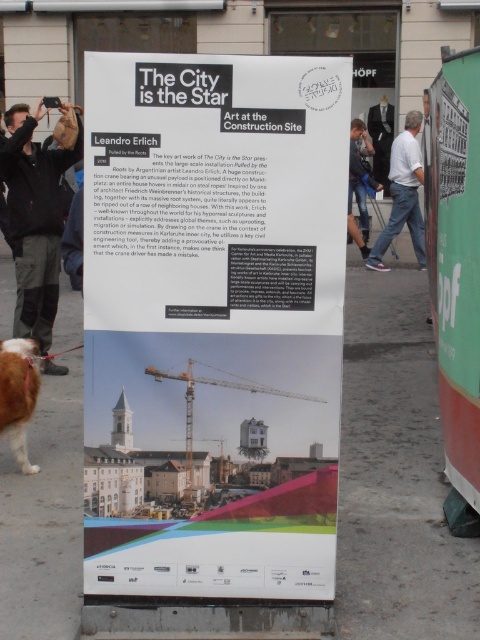
You are standing in front of the white paper poster at center. Where exactly is the poster located in the image?

The white paper poster at center is located at the point 0.500 on the x axis and 0.446 on the y axis.